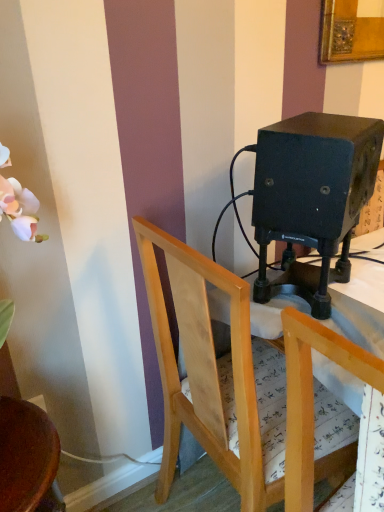
Locate an element on the screen. This screenshot has height=512, width=384. wooden chair at center, placed as the second chair when sorted from right to left is located at coordinates (209, 373).

I want to click on wooden chair at lower left, which is counted as the 3th chair, starting from the right, so click(27, 458).

Locate an element on the screen. This screenshot has width=384, height=512. wooden chair at center, which is the second chair from left to right is located at coordinates (209, 373).

Is wooden chair at lower left, which is counted as the 3th chair, starting from the right, not within light wood chair at center, the third chair from the left?

That's correct, wooden chair at lower left, which is counted as the 3th chair, starting from the right, is outside of light wood chair at center, the third chair from the left.

Could you tell me if wooden chair at lower left, which is counted as the 3th chair, starting from the right, is facing light wood chair at center, the third chair from the left?

No, wooden chair at lower left, which is counted as the 3th chair, starting from the right, is not aimed at light wood chair at center, the third chair from the left.

Where is `the 1st chair behind the light wood chair at center, positioned as the first chair in right-to-left order`? This screenshot has width=384, height=512. the 1st chair behind the light wood chair at center, positioned as the first chair in right-to-left order is located at coordinates (27, 458).

Is wooden chair at center, which is the second chair from left to right, oriented towards light wood chair at center, positioned as the first chair in right-to-left order?

No, wooden chair at center, which is the second chair from left to right, is not aimed at light wood chair at center, positioned as the first chair in right-to-left order.

Considering the sizes of objects wooden chair at center, which is the second chair from left to right, and light wood chair at center, the third chair from the left, in the image provided, who is bigger, wooden chair at center, which is the second chair from left to right, or light wood chair at center, the third chair from the left,?

wooden chair at center, which is the second chair from left to right.

From a real-world perspective, is wooden chair at center, placed as the second chair when sorted from right to left, positioned above or below light wood chair at center, positioned as the first chair in right-to-left order?

Clearly, from a real-world perspective, wooden chair at center, placed as the second chair when sorted from right to left, is below light wood chair at center, positioned as the first chair in right-to-left order.

Which is closer to the camera, (144, 224) or (303, 358)?

The point (303, 358) is closer.

Which is behind, light wood chair at center, positioned as the first chair in right-to-left order, or wooden chair at lower left, which is counted as the 3th chair, starting from the right?

wooden chair at lower left, which is counted as the 3th chair, starting from the right, is further from the camera.

From a real-world perspective, is light wood chair at center, positioned as the first chair in right-to-left order, on wooden chair at lower left, the first chair when ordered from left to right?

Yes, from a real-world perspective, light wood chair at center, positioned as the first chair in right-to-left order, is on top of wooden chair at lower left, the first chair when ordered from left to right.

Considering the points (318, 342) and (13, 488), which point is behind, point (318, 342) or point (13, 488)?

Positioned behind is point (13, 488).

Could you tell me if light wood chair at center, the third chair from the left, is facing wooden chair at lower left, the first chair when ordered from left to right?

No.

Between wooden chair at center, placed as the second chair when sorted from right to left, and wooden chair at lower left, the first chair when ordered from left to right, which one has larger width?

wooden chair at center, placed as the second chair when sorted from right to left, is wider.

From a real-world perspective, who is located lower, wooden chair at center, which is the second chair from left to right, or wooden chair at lower left, the first chair when ordered from left to right?

wooden chair at lower left, the first chair when ordered from left to right.

From the image's perspective, count 2nd chairs downward from the wooden chair at center, which is the second chair from left to right, and point to it. Please provide its 2D coordinates.

[(27, 458)]

Considering the sizes of light wood chair at center, positioned as the first chair in right-to-left order, and wooden chair at center, placed as the second chair when sorted from right to left, in the image, is light wood chair at center, positioned as the first chair in right-to-left order, bigger or smaller than wooden chair at center, placed as the second chair when sorted from right to left,?

light wood chair at center, positioned as the first chair in right-to-left order, is smaller than wooden chair at center, placed as the second chair when sorted from right to left.

You are a GUI agent. You are given a task and a screenshot of the screen. Output one action in this format:
    pyautogui.click(x=<x>, y=<y>)
    Task: Click on the 2nd chair in front of the wooden chair at center, which is the second chair from left to right
    
    Given the screenshot: What is the action you would take?
    pyautogui.click(x=312, y=395)

Considering the relative sizes of light wood chair at center, the third chair from the left, and wooden chair at center, which is the second chair from left to right, in the image provided, is light wood chair at center, the third chair from the left, thinner than wooden chair at center, which is the second chair from left to right,?

Yes.

From the image's perspective, is light wood chair at center, positioned as the first chair in right-to-left order, below wooden chair at center, placed as the second chair when sorted from right to left?

Indeed, from the image's perspective, light wood chair at center, positioned as the first chair in right-to-left order, is shown beneath wooden chair at center, placed as the second chair when sorted from right to left.

How distant is wooden chair at lower left, which is counted as the 3th chair, starting from the right, from wooden chair at center, placed as the second chair when sorted from right to left?

wooden chair at lower left, which is counted as the 3th chair, starting from the right, and wooden chair at center, placed as the second chair when sorted from right to left, are 16.41 inches apart.

Is wooden chair at lower left, the first chair when ordered from left to right, directly adjacent to wooden chair at center, which is the second chair from left to right?

No, wooden chair at lower left, the first chair when ordered from left to right, is not touching wooden chair at center, which is the second chair from left to right.

Is wooden chair at lower left, which is counted as the 3th chair, starting from the right, shorter than wooden chair at center, placed as the second chair when sorted from right to left?

Yes.

Between wooden chair at lower left, which is counted as the 3th chair, starting from the right, and wooden chair at center, which is the second chair from left to right, which one appears on the left side from the viewer's perspective?

wooden chair at lower left, which is counted as the 3th chair, starting from the right.

Find the location of `chair below the light wood chair at center, the third chair from the left (from the image's perspective)`. chair below the light wood chair at center, the third chair from the left (from the image's perspective) is located at coordinates (27, 458).

Starting from the light wood chair at center, positioned as the first chair in right-to-left order, which chair is the 2nd one behind? Please provide its 2D coordinates.

[(209, 373)]

Estimate the real-world distances between objects in this image. Which object is further from light wood chair at center, positioned as the first chair in right-to-left order, wooden chair at center, placed as the second chair when sorted from right to left, or wooden chair at lower left, the first chair when ordered from left to right?

wooden chair at lower left, the first chair when ordered from left to right, is further to light wood chair at center, positioned as the first chair in right-to-left order.

Estimate the real-world distances between objects in this image. Which object is closer to wooden chair at lower left, which is counted as the 3th chair, starting from the right, wooden chair at center, which is the second chair from left to right, or light wood chair at center, the third chair from the left?

wooden chair at center, which is the second chair from left to right, lies closer to wooden chair at lower left, which is counted as the 3th chair, starting from the right, than the other object.

When comparing their distances from wooden chair at lower left, which is counted as the 3th chair, starting from the right, does light wood chair at center, positioned as the first chair in right-to-left order, or wooden chair at center, placed as the second chair when sorted from right to left, seem further?

light wood chair at center, positioned as the first chair in right-to-left order, lies further to wooden chair at lower left, which is counted as the 3th chair, starting from the right, than the other object.

Based on their spatial positions, is wooden chair at lower left, which is counted as the 3th chair, starting from the right, or wooden chair at center, which is the second chair from left to right, further from light wood chair at center, the third chair from the left?

Based on the image, wooden chair at lower left, which is counted as the 3th chair, starting from the right, appears to be further to light wood chair at center, the third chair from the left.

Based on their spatial positions, is wooden chair at lower left, the first chair when ordered from left to right, or light wood chair at center, positioned as the first chair in right-to-left order, closer to wooden chair at center, placed as the second chair when sorted from right to left?

Based on the image, light wood chair at center, positioned as the first chair in right-to-left order, appears to be nearer to wooden chair at center, placed as the second chair when sorted from right to left.

Consider the image. Which object lies further to the anchor point wooden chair at center, placed as the second chair when sorted from right to left, light wood chair at center, positioned as the first chair in right-to-left order, or wooden chair at lower left, which is counted as the 3th chair, starting from the right?

Among the two, wooden chair at lower left, which is counted as the 3th chair, starting from the right, is located further to wooden chair at center, placed as the second chair when sorted from right to left.

This screenshot has height=512, width=384. What are the coordinates of `chair between wooden chair at lower left, which is counted as the 3th chair, starting from the right, and light wood chair at center, the third chair from the left` in the screenshot? It's located at (209, 373).